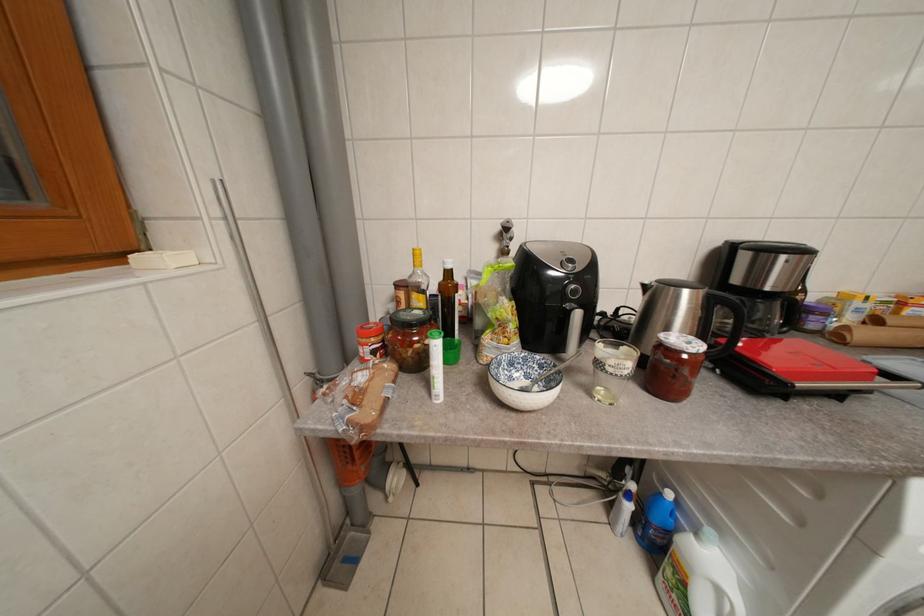
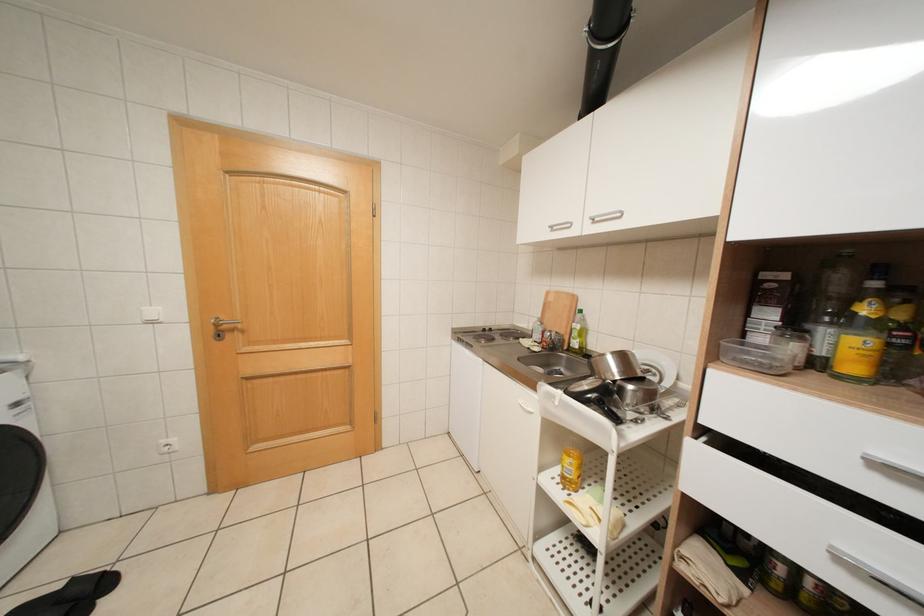
Based on the continuous images, in which direction is the camera rotating?

The camera's rotation is toward right-down.